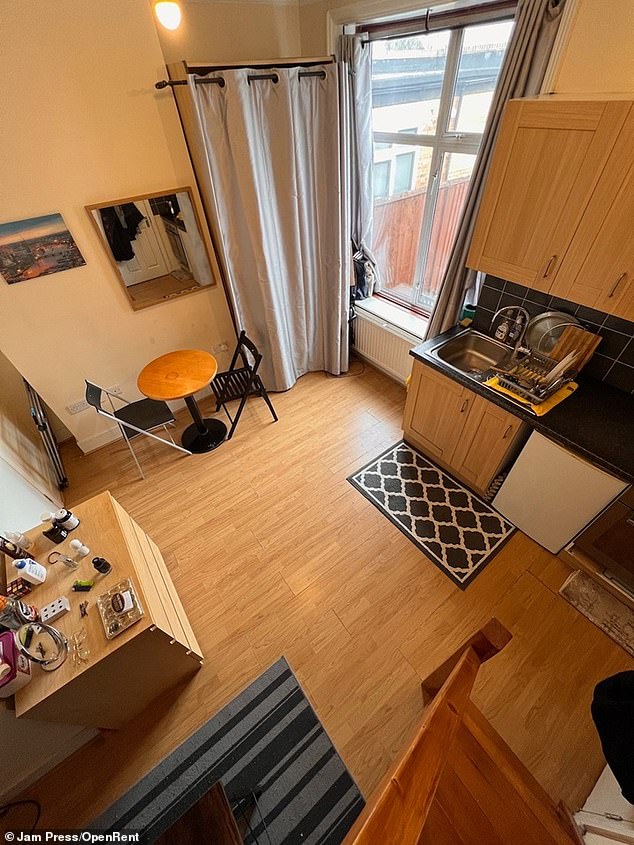
Identify the location of light. (169, 17).